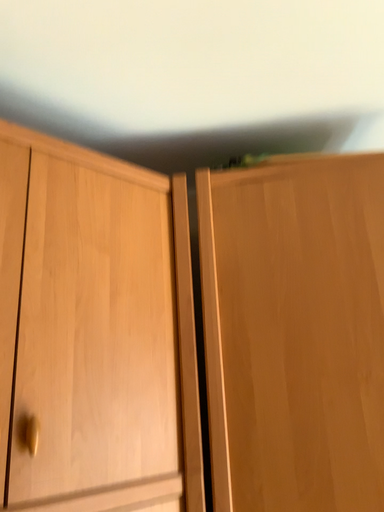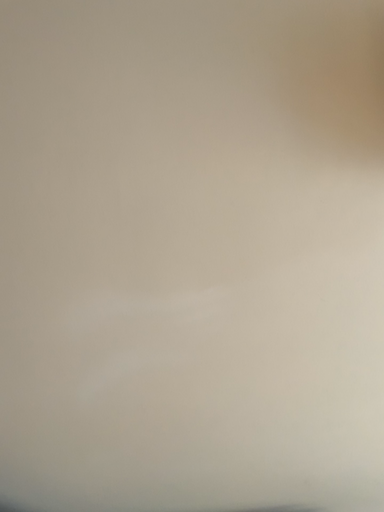
Question: Which way did the camera rotate in the video?

Choices:
 (A) rotated upward
 (B) rotated downward

Answer: (A)